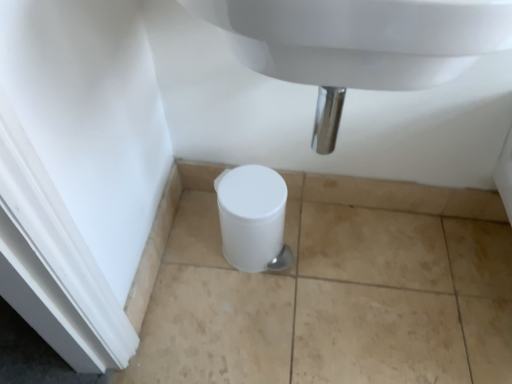
Measure the distance between point (421, 17) and camera.

They are 15.20 inches apart.

This screenshot has width=512, height=384. What do you see at coordinates (359, 43) in the screenshot? I see `white glossy sink at center` at bounding box center [359, 43].

Where is `white glossy sink at center`? white glossy sink at center is located at coordinates (359, 43).

Locate an element on the screen. Image resolution: width=512 pixels, height=384 pixels. white plastic toilet at lower center is located at coordinates (252, 218).

The image size is (512, 384). What do you see at coordinates (252, 218) in the screenshot?
I see `white plastic toilet at lower center` at bounding box center [252, 218].

This screenshot has width=512, height=384. In order to click on white glossy sink at center in this screenshot , I will do `click(359, 43)`.

Between white plastic toilet at lower center and white glossy sink at center, which one appears on the left side from the viewer's perspective?

white plastic toilet at lower center is more to the left.

Based on the photo, is white plastic toilet at lower center in front of white glossy sink at center?

No, it is behind white glossy sink at center.

Which is nearer, (221, 183) or (376, 3)?

Point (221, 183) is positioned farther from the camera compared to point (376, 3).

Consider the image. From the image's perspective, relative to white glossy sink at center, is white plastic toilet at lower center above or below?

white plastic toilet at lower center is situated lower than white glossy sink at center in the image.

From a real-world perspective, is white plastic toilet at lower center positioned above or below white glossy sink at center?

Clearly, from a real-world perspective, white plastic toilet at lower center is below white glossy sink at center.

Between white plastic toilet at lower center and white glossy sink at center, which one has larger width?

white glossy sink at center is wider.

Considering the sizes of objects white plastic toilet at lower center and white glossy sink at center in the image provided, who is shorter, white plastic toilet at lower center or white glossy sink at center?

With less height is white plastic toilet at lower center.

Consider the image. Considering the sizes of white plastic toilet at lower center and white glossy sink at center in the image, is white plastic toilet at lower center bigger or smaller than white glossy sink at center?

Considering their sizes, white plastic toilet at lower center takes up less space than white glossy sink at center.

Is white plastic toilet at lower center inside or outside of white glossy sink at center?

white plastic toilet at lower center exists outside the volume of white glossy sink at center.

Is white plastic toilet at lower center not near white glossy sink at center?

No.

Is white plastic toilet at lower center aimed at white glossy sink at center?

No.

Can you tell me how much white plastic toilet at lower center and white glossy sink at center differ in facing direction?

The angle between the facing direction of white plastic toilet at lower center and the facing direction of white glossy sink at center is 1.48 degrees.

Measure the distance from white plastic toilet at lower center to white glossy sink at center.

white plastic toilet at lower center and white glossy sink at center are 21.48 inches apart from each other.

Image resolution: width=512 pixels, height=384 pixels. Find the location of `sink above the white plastic toilet at lower center (from a real-world perspective)`. sink above the white plastic toilet at lower center (from a real-world perspective) is located at coordinates (359, 43).

Does white glossy sink at center appear on the right side of white plastic toilet at lower center?

Yes, white glossy sink at center is to the right of white plastic toilet at lower center.

Is the depth of white glossy sink at center greater than that of white plastic toilet at lower center?

No, it is in front of white plastic toilet at lower center.

Is point (407, 56) more distant than point (252, 184)?

No, (407, 56) is closer to viewer.

From the image's perspective, is white glossy sink at center positioned above or below white plastic toilet at lower center?

Based on their image positions, white glossy sink at center is located above white plastic toilet at lower center.

From a real-world perspective, is white glossy sink at center located beneath white plastic toilet at lower center?

Incorrect, from a real-world perspective, white glossy sink at center is higher than white plastic toilet at lower center.

Consider the image. Can you confirm if white glossy sink at center is wider than white plastic toilet at lower center?

Correct, the width of white glossy sink at center exceeds that of white plastic toilet at lower center.

Considering the relative sizes of white glossy sink at center and white plastic toilet at lower center in the image provided, is white glossy sink at center shorter than white plastic toilet at lower center?

Incorrect, the height of white glossy sink at center does not fall short of that of white plastic toilet at lower center.

Looking at this image, can you confirm if white glossy sink at center is bigger than white plastic toilet at lower center?

Yes.

Looking at this image, choose the correct answer: Is white glossy sink at center inside white plastic toilet at lower center or outside it?

white glossy sink at center is outside white plastic toilet at lower center.

Is white glossy sink at center positioned far away from white plastic toilet at lower center?

Actually, white glossy sink at center and white plastic toilet at lower center are a little close together.

Is white glossy sink at center looking in the opposite direction of white plastic toilet at lower center?

No, white glossy sink at center is not facing the opposite direction of white plastic toilet at lower center.

Identify the location of sink that appears above the white plastic toilet at lower center (from the image's perspective). The height and width of the screenshot is (384, 512). (359, 43).

The image size is (512, 384). I want to click on toilet directly beneath the white glossy sink at center (from a real-world perspective), so click(x=252, y=218).

In the image, there is a white glossy sink at center. Identify the location of toilet below it (from the image's perspective). The image size is (512, 384). (252, 218).